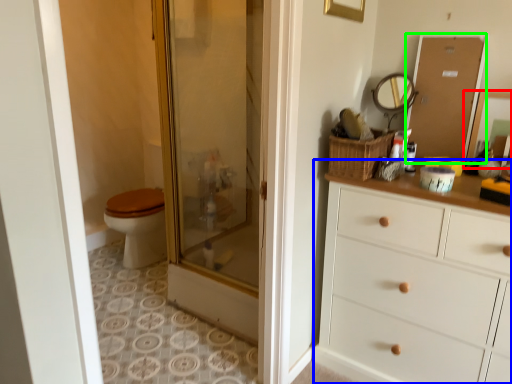
Question: Which object is the farthest from mirror (highlighted by a red box)? Choose among these: chest of drawers (highlighted by a blue box) or screen door (highlighted by a green box).

Choices:
 (A) chest of drawers
 (B) screen door

Answer: (A)